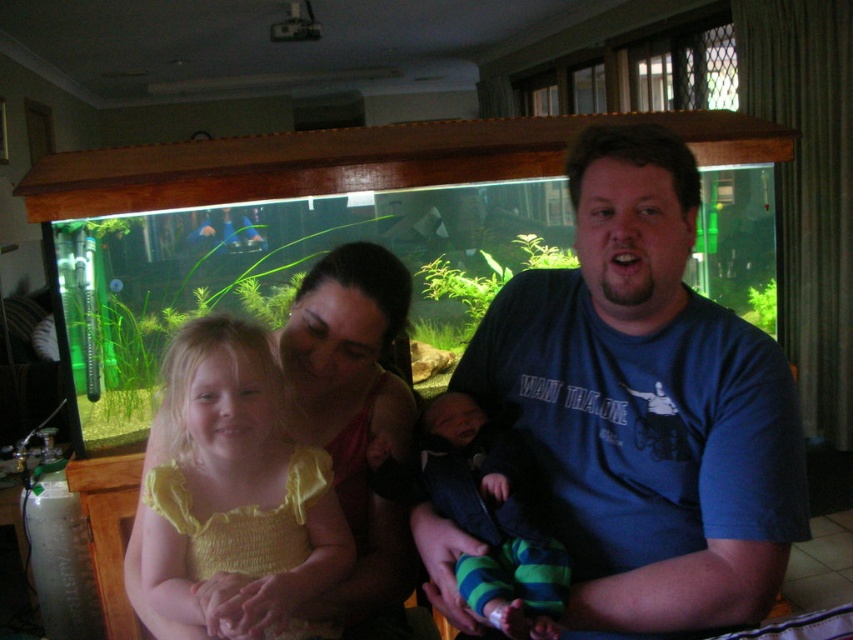
You are a fashion designer observing the family in front of the aquarium. You notice the blue cotton shirt at center and the striped knit pants at center. Which clothing item has a greater horizontal measurement?

The blue cotton shirt at center has a greater horizontal measurement than the striped knit pants at center because its width surpasses the pants.

You are a photographer trying to capture a candid shot of the family. You notice the yellow fabric dress at center and the striped knit pants at center. Which clothing item should you focus on to ensure it appears larger in your photo?

The yellow fabric dress at center is taller than striped knit pants at center, so focusing on the yellow fabric dress at center will make it appear larger in the photo.

You are a photographer who wants to capture a photo of the blue cotton shirt at center and the yellow fabric dress at center. Based on their positions, which one should you focus on first if you want to capture both in a single frame without moving the camera?

The yellow fabric dress at center should be focused on first because the blue cotton shirt at center is positioned on the right side of it, so adjusting focus to the left side first would allow both to be in frame.